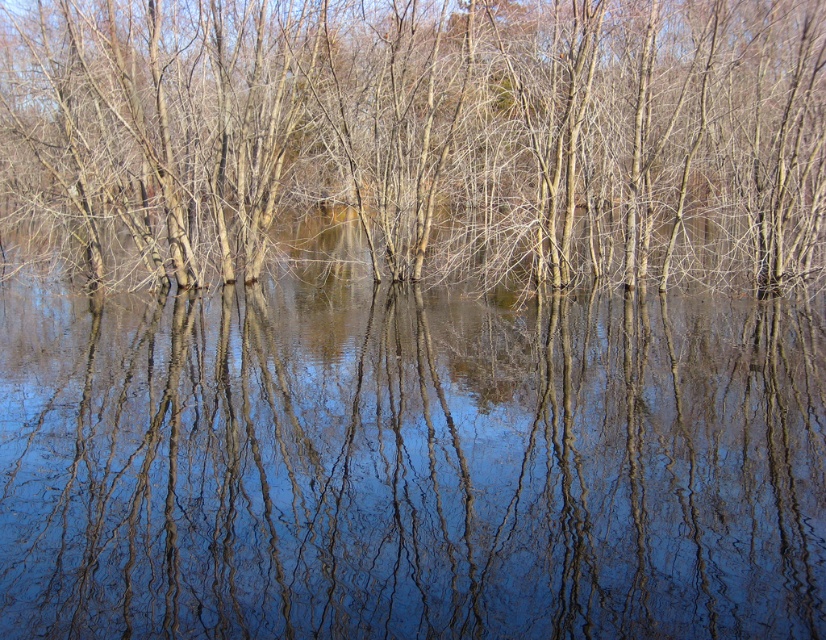
Which is above, transparent water at center or brown matte tree at center?

brown matte tree at center is above.

You are a GUI agent. You are given a task and a screenshot of the screen. Output one action in this format:
    pyautogui.click(x=<x>, y=<y>)
    Task: Click on the transparent water at center
    This screenshot has width=826, height=640.
    Given the screenshot: What is the action you would take?
    pyautogui.click(x=407, y=460)

At what (x,y) coordinates should I click in order to perform the action: click on transparent water at center. Please return your answer as a coordinate pair (x, y). The height and width of the screenshot is (640, 826). Looking at the image, I should click on (407, 460).